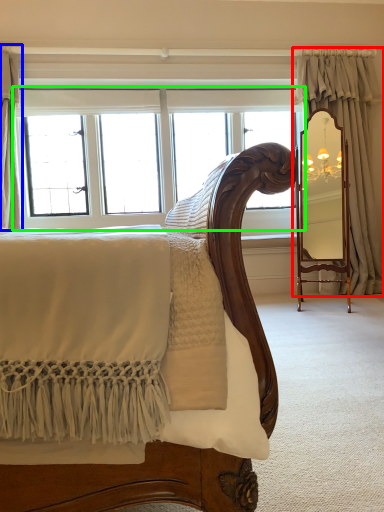
Question: Which object is the farthest from curtain (highlighted by a red box)? Choose among these: curtain (highlighted by a blue box) or window (highlighted by a green box).

Choices:
 (A) curtain
 (B) window

Answer: (A)